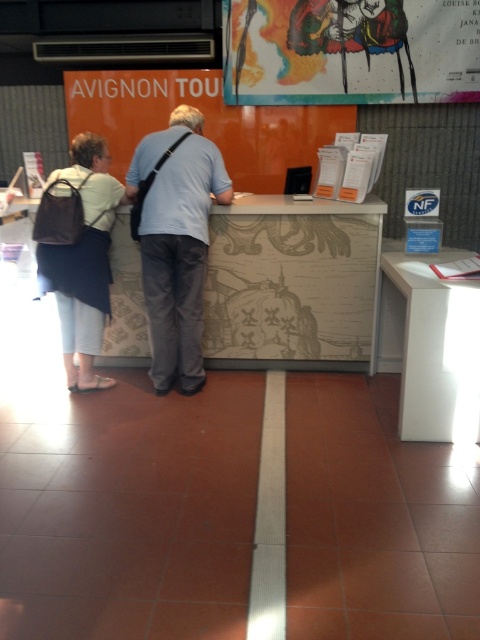
You are a visitor at a reception desk and notice two items of interest. One is the colorful painted figure at upper center and the other is the light blue shirt at center. Which of these two items is bigger in size?

The colorful painted figure at upper center is larger in size than the light blue shirt at center.

You are standing at the entrance of the reception area and want to approach the beige textured desk at center. Which direction should you move relative to your current position?

The beige textured desk at center is located at point 0.444 on the x and 0.610 on the y coordinates, so you should move forward and slightly to the right to reach it.

You are a delivery person with a 28 inch wide package. You need to place it on the beige textured desk at center without moving the matte black backpack at left. Is there enough space between them?

The distance between the beige textured desk at center and the matte black backpack at left is 33.71 inches. Since the package is 28 inches wide, there is enough space to place it between them.